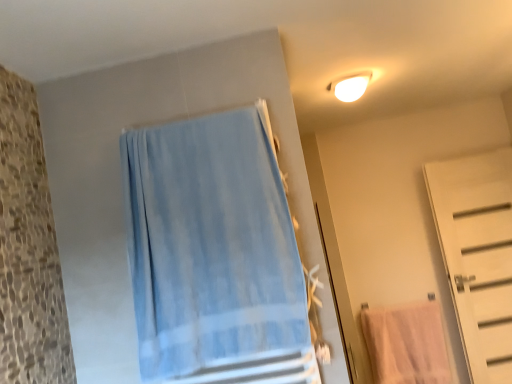
Question: From a real-world perspective, does white matte door at right stand above light blue fabric towel at center?

Choices:
 (A) no
 (B) yes

Answer: (A)

Question: Is white matte door at right oriented away from light blue fabric towel at center?

Choices:
 (A) yes
 (B) no

Answer: (B)

Question: Does white matte door at right lie behind light blue fabric towel at center?

Choices:
 (A) yes
 (B) no

Answer: (A)

Question: Could you tell me if white matte door at right is facing light blue fabric towel at center?

Choices:
 (A) yes
 (B) no

Answer: (B)

Question: Is white matte door at right next to light blue fabric towel at center?

Choices:
 (A) no
 (B) yes

Answer: (A)

Question: Does white matte door at right have a greater height compared to light blue fabric towel at center?

Choices:
 (A) yes
 (B) no

Answer: (A)

Question: Does white glossy light fixture at upper right come in front of white matte door at right?

Choices:
 (A) yes
 (B) no

Answer: (A)

Question: From a real-world perspective, is white glossy light fixture at upper right physically below white matte door at right?

Choices:
 (A) yes
 (B) no

Answer: (B)

Question: Is white glossy light fixture at upper right to the left of white matte door at right from the viewer's perspective?

Choices:
 (A) yes
 (B) no

Answer: (A)

Question: Can you confirm if white glossy light fixture at upper right is smaller than white matte door at right?

Choices:
 (A) no
 (B) yes

Answer: (B)

Question: Is white glossy light fixture at upper right next to white matte door at right and touching it?

Choices:
 (A) yes
 (B) no

Answer: (B)

Question: Is white glossy light fixture at upper right bigger than white matte door at right?

Choices:
 (A) yes
 (B) no

Answer: (B)

Question: Is pink cotton towel at lower right positioned beyond the bounds of white glossy light fixture at upper right?

Choices:
 (A) yes
 (B) no

Answer: (A)